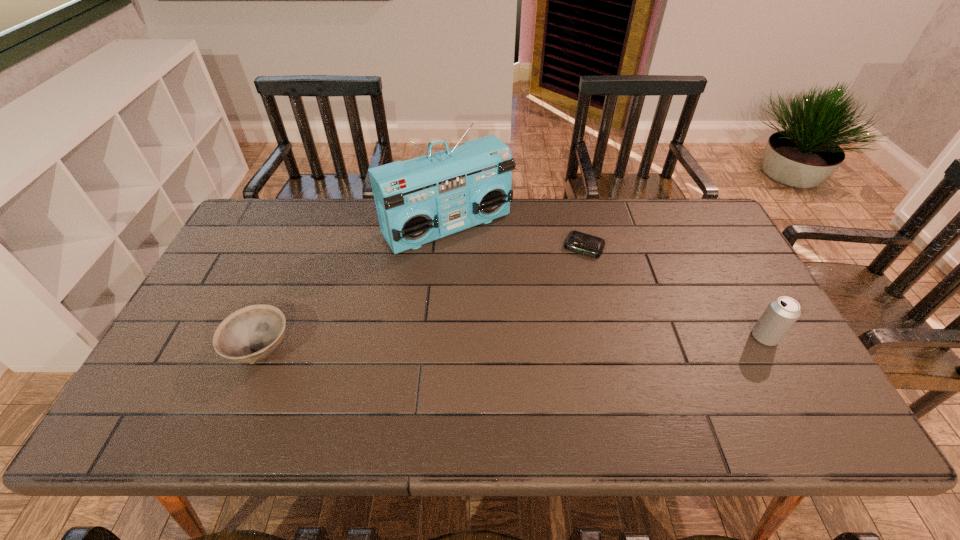
You are a GUI agent. You are given a task and a screenshot of the screen. Output one action in this format:
    pyautogui.click(x=<x>, y=<y>)
    Task: Click on the vacant space that satisfies the following two spatial constraints: 1. on the front side of the third shortest object; 2. on the right side of the second object from left to right
    
    Given the screenshot: What is the action you would take?
    pyautogui.click(x=439, y=337)

I want to click on vacant position in the image that satisfies the following two spatial constraints: 1. on the back side of the tallest object; 2. on the left side of the bowl, so click(312, 227).